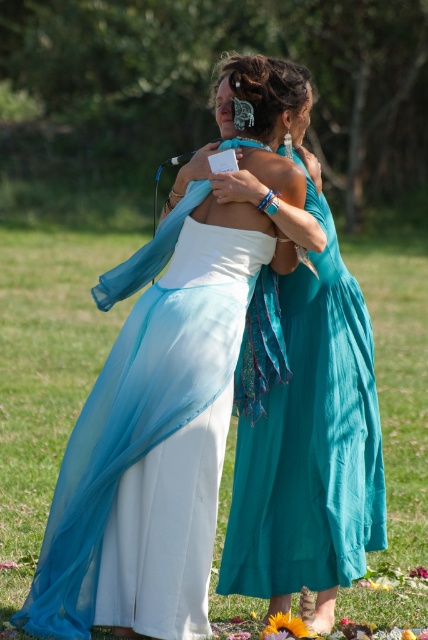
Can you confirm if white satin dress at center is wider than teal chiffon dress at center?

Indeed, white satin dress at center has a greater width compared to teal chiffon dress at center.

Can you confirm if white satin dress at center is positioned below teal chiffon dress at center?

No.

Does point (59, 628) come farther from viewer compared to point (350, 284)?

No, (59, 628) is closer to viewer.

Identify the location of white satin dress at center. The width and height of the screenshot is (428, 640). (157, 429).